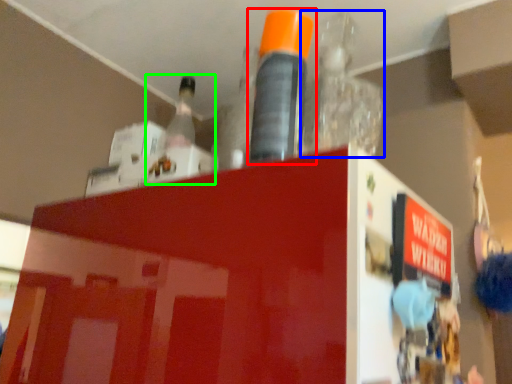
Question: Estimate the real-world distances between objects in this image. Which object is closer to bottle (highlighted by a red box), bottle (highlighted by a blue box) or bottle (highlighted by a green box)?

Choices:
 (A) bottle
 (B) bottle

Answer: (A)